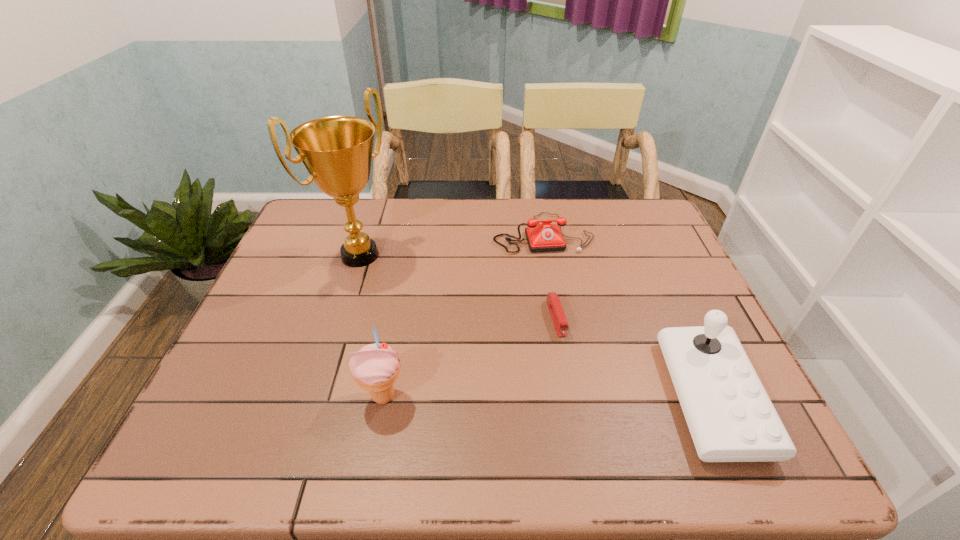
Locate an element on the screen. This screenshot has height=540, width=960. free spot on the desktop that is between the icecream and the joystick and is positioned on the front view with handles of the tallest object is located at coordinates (547, 397).

The image size is (960, 540). I want to click on free spot on the desktop that is between the icecream and the rightmost object and is positioned on the dial of the telephone, so click(593, 397).

This screenshot has width=960, height=540. In order to click on vacant spot on the desktop that is between the icecream and the rightmost object and is positioned on the front-facing side of the third farthest object in this screenshot , I will do `click(584, 397)`.